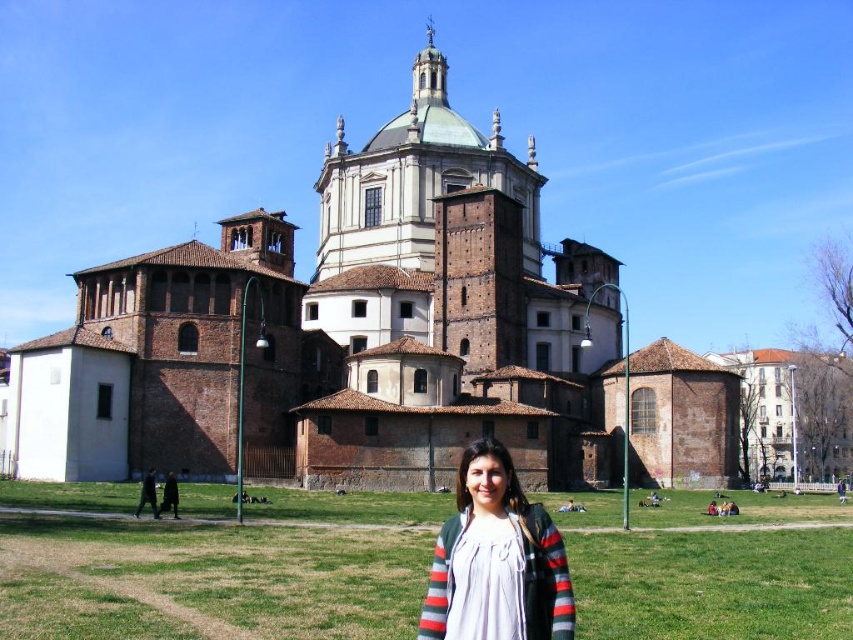
You are a photographer trying to capture the brown brick church at center and the white cotton shirt at lower center in the same frame. Which object should you focus on first if you want to ensure both are in focus?

The brown brick church at center is taller than the white cotton shirt at lower center, so you should focus on the brown brick church at center first to ensure both are in focus.

You are standing at the point with coordinates (404, 330) in the image. What object is located at that point?

The point at coordinates (404, 330) corresponds to the brown brick church at center.

You are a photographer trying to capture the brown brick church at center and the white cotton shirt at lower center in the same frame. Based on their positions, which object appears closer to the camera?

The white cotton shirt at lower center appears closer to the camera since it is positioned below the brown brick church at center, which is placed higher in the frame.